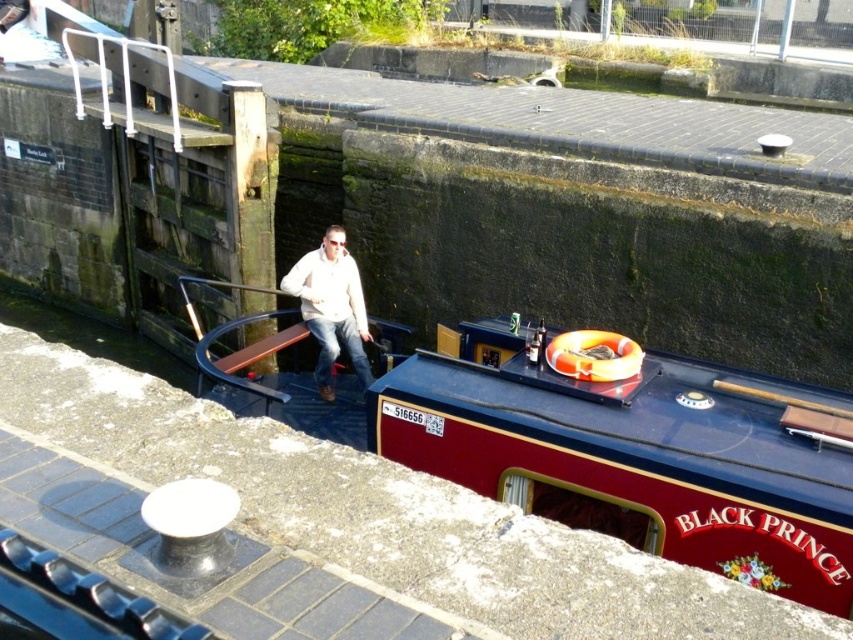
Question: Is maroon polished wood boat at center positioned behind white matte jacket at center?

Choices:
 (A) yes
 (B) no

Answer: (B)

Question: Is maroon polished wood boat at center to the right of white matte jacket at center from the viewer's perspective?

Choices:
 (A) yes
 (B) no

Answer: (A)

Question: Among these objects, which one is nearest to the camera?

Choices:
 (A) maroon polished wood boat at center
 (B) white matte jacket at center

Answer: (A)

Question: Is the position of maroon polished wood boat at center less distant than that of white matte jacket at center?

Choices:
 (A) yes
 (B) no

Answer: (A)

Question: Which of the following is the farthest from the observer?

Choices:
 (A) [x=328, y=241]
 (B) [x=779, y=412]

Answer: (A)